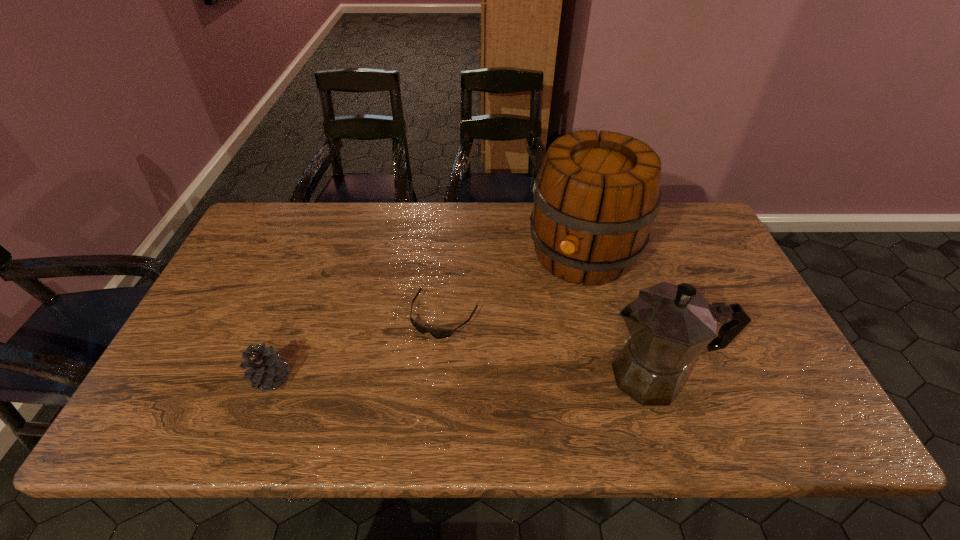
You are a GUI agent. You are given a task and a screenshot of the screen. Output one action in this format:
    pyautogui.click(x=<x>, y=<y>)
    Task: Click on the free space at the near edge
    
    Given the screenshot: What is the action you would take?
    pyautogui.click(x=458, y=376)

This screenshot has height=540, width=960. What are the coordinates of `vacant space at the left edge of the desktop` in the screenshot? It's located at (221, 280).

This screenshot has height=540, width=960. Find the location of `free spot at the right edge of the desktop`. free spot at the right edge of the desktop is located at coordinates (756, 328).

The height and width of the screenshot is (540, 960). In order to click on vacant area at the far left corner in this screenshot , I will do `click(257, 228)`.

At what (x,y) coordinates should I click in order to perform the action: click on free region at the far right corner of the desktop. Please return your answer as a coordinate pair (x, y). The image size is (960, 540). Looking at the image, I should click on (718, 249).

Find the location of a particular element. free spot between the cider and the pinecone is located at coordinates [x=427, y=316].

Locate an element on the screen. The image size is (960, 540). vacant region between the coffeepot and the leftmost object is located at coordinates (463, 377).

Image resolution: width=960 pixels, height=540 pixels. What are the coordinates of `empty space between the leftmost object and the third object from right to left` in the screenshot? It's located at (358, 347).

At what (x,y) coordinates should I click in order to perform the action: click on free area in between the coffeepot and the second shortest object. Please return your answer as a coordinate pair (x, y). Looking at the image, I should click on [x=463, y=377].

Image resolution: width=960 pixels, height=540 pixels. What are the coordinates of `unoccupied area between the coffeepot and the pinecone` in the screenshot? It's located at 463,377.